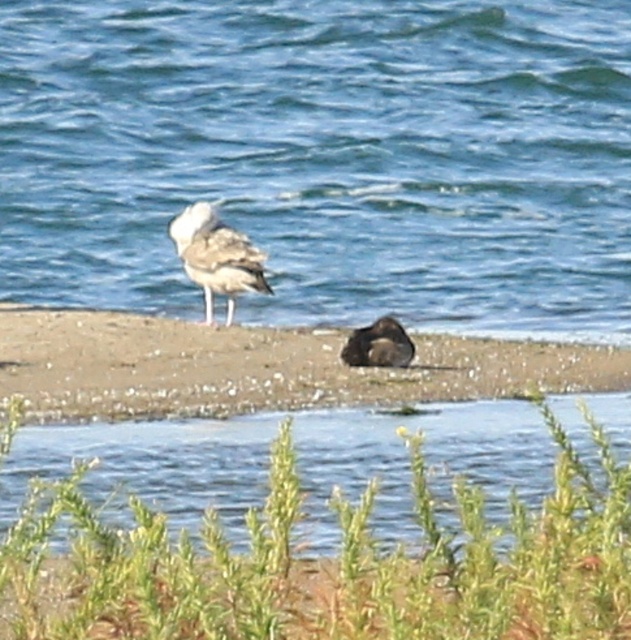
Question: Estimate the real-world distances between objects in this image. Which object is closer to the green leafy plant at lower center?

Choices:
 (A) blue water at center
 (B) white feathered bird at center
 (C) brown sandy beach at center
 (D) brown fuzzy bird at center

Answer: (C)

Question: Does green leafy plant at lower center have a greater width compared to brown fuzzy bird at center?

Choices:
 (A) no
 (B) yes

Answer: (B)

Question: Which object appears closest to the camera in this image?

Choices:
 (A) blue water at center
 (B) green leafy plant at lower center

Answer: (B)

Question: Is blue water at center to the right of brown fuzzy bird at center from the viewer's perspective?

Choices:
 (A) yes
 (B) no

Answer: (B)

Question: Does white feathered bird at center appear over brown fuzzy bird at center?

Choices:
 (A) no
 (B) yes

Answer: (B)

Question: Which of the following is the closest to the observer?

Choices:
 (A) green leafy plant at lower center
 (B) brown sandy beach at center
 (C) white feathered bird at center
 (D) brown fuzzy bird at center

Answer: (A)